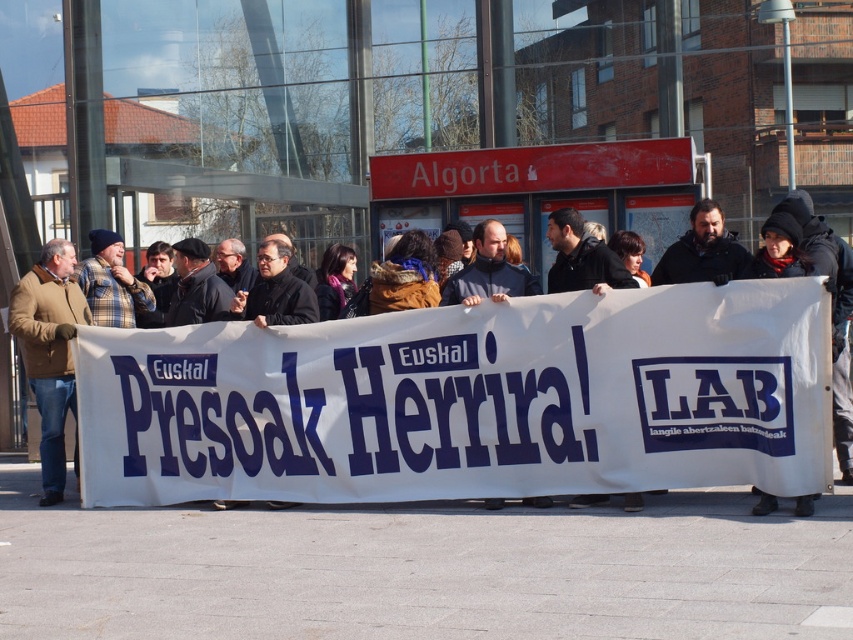
What object is located at the coordinates point (467, 401) in the image?

The point (467, 401) corresponds to the white paper banner at center.

You are a photographer trying to capture the white paper banner at center in a photo. The camera you are using has a focal length of 50mm. If you want to ensure the banner is in focus, where should you focus the camera?

You should focus the camera at the point where the white paper banner at center is located, which is at coordinates point (467, 401). This ensures the banner will be in focus.